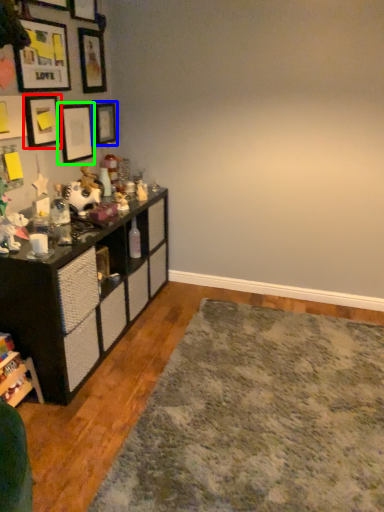
Question: Which is nearer to the picture frame (highlighted by a red box)? picture frame (highlighted by a blue box) or picture frame (highlighted by a green box).

Choices:
 (A) picture frame
 (B) picture frame

Answer: (B)